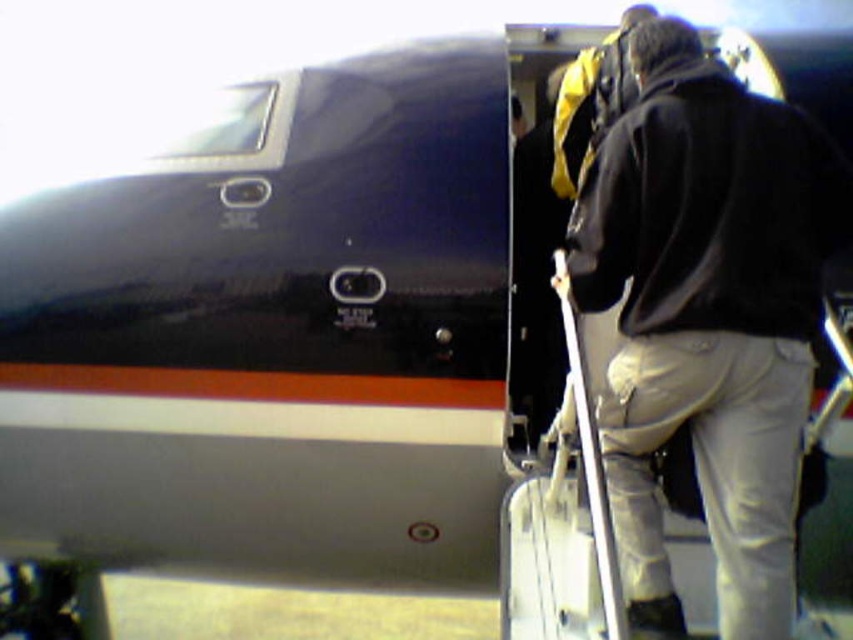
Question: Which point is closer to the camera taking this photo?

Choices:
 (A) (550, 557)
 (B) (764, 513)

Answer: (B)

Question: Can you confirm if black leather jacket at center is thinner than white matte suitcase at center?

Choices:
 (A) yes
 (B) no

Answer: (B)

Question: Which point is closer to the camera?

Choices:
 (A) black leather jacket at center
 (B) white matte suitcase at center

Answer: (B)

Question: From the image, what is the correct spatial relationship of black leather jacket at center in relation to white matte suitcase at center?

Choices:
 (A) left
 (B) right

Answer: (B)

Question: Does black leather jacket at center appear under white matte suitcase at center?

Choices:
 (A) yes
 (B) no

Answer: (B)